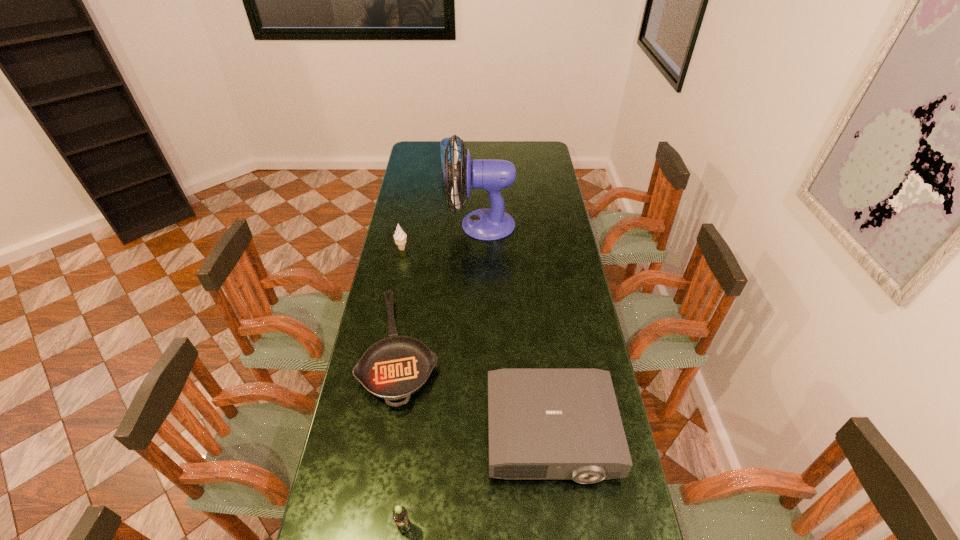
The width and height of the screenshot is (960, 540). Identify the location of free space at the far edge. (476, 148).

Image resolution: width=960 pixels, height=540 pixels. What are the coordinates of `free location at the left edge` in the screenshot? It's located at (362, 537).

At what (x,y) coordinates should I click in order to perform the action: click on vacant area at the right edge of the desktop. Please return your answer as a coordinate pair (x, y). Looking at the image, I should click on (540, 186).

Identify the location of vacant space at the far left corner of the desktop. The image size is (960, 540). (438, 147).

At what (x,y) coordinates should I click in order to perform the action: click on free spot between the frying pan and the projector. Please return your answer as a coordinate pair (x, y). This screenshot has height=540, width=960. Looking at the image, I should click on (476, 391).

Locate an element on the screen. This screenshot has height=540, width=960. vacant region between the projector and the icecream is located at coordinates (476, 341).

The width and height of the screenshot is (960, 540). I want to click on free spot between the soda and the tallest object, so click(x=443, y=376).

Locate an element on the screen. empty space that is in between the tallest object and the icecream is located at coordinates (442, 237).

Where is `free space between the mug and the frying pan`? free space between the mug and the frying pan is located at coordinates (427, 258).

Locate an element on the screen. This screenshot has width=960, height=540. vacant area between the nearest object and the shortest object is located at coordinates (403, 438).